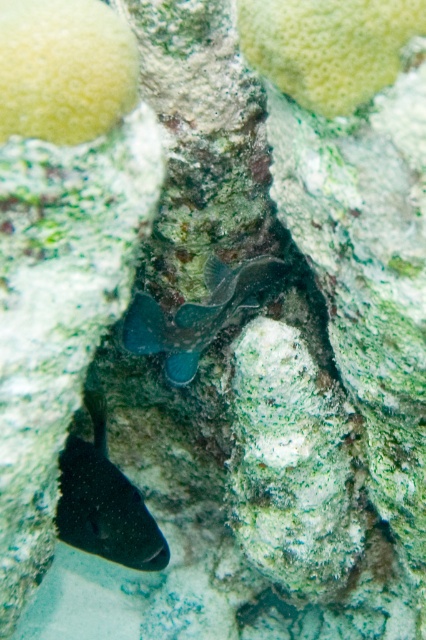
Question: Which object appears closest to the camera in this image?

Choices:
 (A) shiny black fish at lower left
 (B) shiny blue fish at center

Answer: (B)

Question: Among these objects, which one is farthest from the camera?

Choices:
 (A) shiny blue fish at center
 (B) shiny black fish at lower left

Answer: (B)

Question: Does shiny black fish at lower left appear on the left side of shiny blue fish at center?

Choices:
 (A) no
 (B) yes

Answer: (B)

Question: Can you confirm if shiny black fish at lower left is positioned above shiny blue fish at center?

Choices:
 (A) no
 (B) yes

Answer: (A)

Question: In this image, where is shiny black fish at lower left located relative to shiny blue fish at center?

Choices:
 (A) right
 (B) left

Answer: (B)